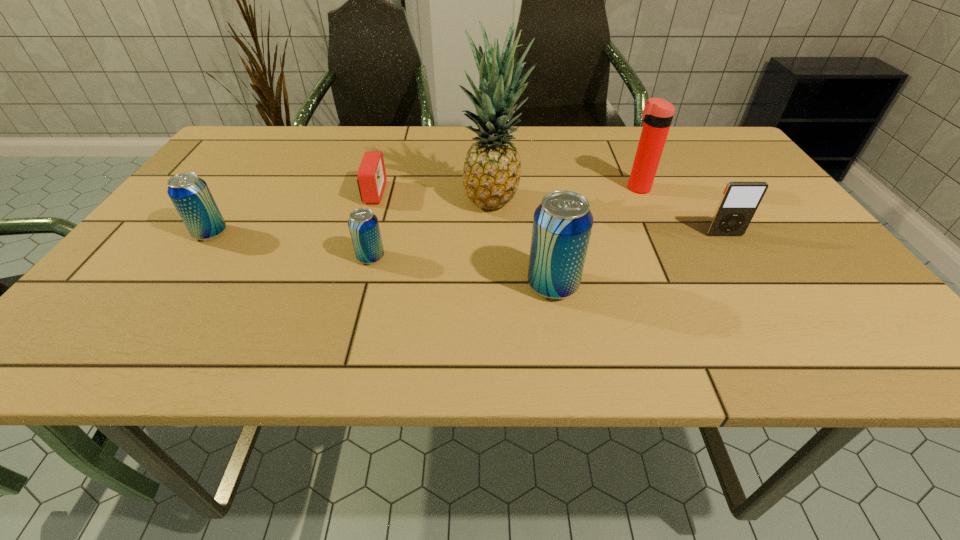
At what (x,y) coordinates should I click in order to perform the action: click on vacant area situated 0.050m on the left of the leftmost object. Please return your answer as a coordinate pair (x, y). The image size is (960, 540). Looking at the image, I should click on (x=172, y=233).

At what (x,y) coordinates should I click in order to perform the action: click on free space located 0.400m on the right of the shortest beer can. Please return your answer as a coordinate pair (x, y). This screenshot has width=960, height=540. Looking at the image, I should click on 576,258.

The image size is (960, 540). Identify the location of blank space located 0.300m on the back of the nearest beer can. (537, 187).

Locate an element on the screen. This screenshot has height=540, width=960. vacant space located 0.320m on the front of the thermos bottle is located at coordinates (683, 286).

This screenshot has width=960, height=540. Identify the location of blank space located on the left of the tallest object. (313, 202).

At what (x,y) coordinates should I click in order to perform the action: click on vacant space located on the front-facing side of the alarm clock. Please return your answer as a coordinate pair (x, y). Looking at the image, I should click on (525, 193).

This screenshot has width=960, height=540. I want to click on free space located on the front-facing side of the iPod, so click(x=745, y=268).

At what (x,y) coordinates should I click in order to perform the action: click on object that is at the near edge. Please return your answer as a coordinate pair (x, y). Image resolution: width=960 pixels, height=540 pixels. Looking at the image, I should click on (562, 224).

At what (x,y) coordinates should I click in order to perform the action: click on object situated at the left edge. Please return your answer as a coordinate pair (x, y). This screenshot has height=540, width=960. Looking at the image, I should click on (190, 194).

Identify the location of object that is positioned at the right edge. The width and height of the screenshot is (960, 540). (740, 200).